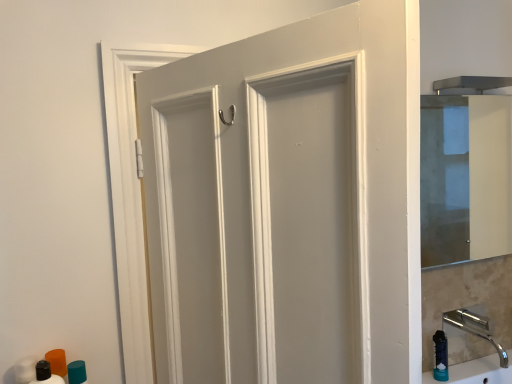
What do you see at coordinates (287, 203) in the screenshot? I see `matte white door at center` at bounding box center [287, 203].

What is the approximate height of matte white door at center?

It is 36.67 inches.

What do you see at coordinates (42, 367) in the screenshot?
I see `matte black bottle at lower left, marked as the second toiletry in a back-to-front arrangement` at bounding box center [42, 367].

Describe the element at coordinates (474, 328) in the screenshot. I see `polished chrome faucet at lower right` at that location.

Locate an element on the screen. Image resolution: width=512 pixels, height=384 pixels. transparent glass cabinet at right is located at coordinates click(x=465, y=178).

From the image's perspective, which is below, teal matte cylinder at lower left, the 1th toiletry viewed from the back, or matte white door at center?

From the image's view, teal matte cylinder at lower left, the 1th toiletry viewed from the back, is below.

Can you tell me how much teal matte cylinder at lower left, the 1th toiletry viewed from the back, and matte white door at center differ in facing direction?

They differ by 111 degrees in their facing directions.

Is teal matte cylinder at lower left, the 2th toiletry from the front, positioned far away from matte white door at center?

No.

Considering the relative sizes of teal matte cylinder at lower left, the 2th toiletry from the front, and matte white door at center in the image provided, is teal matte cylinder at lower left, the 2th toiletry from the front, wider than matte white door at center?

Incorrect, the width of teal matte cylinder at lower left, the 2th toiletry from the front, does not surpass that of matte white door at center.

Where is `mirror that appears above the matte white door at center (from a real-world perspective)`? mirror that appears above the matte white door at center (from a real-world perspective) is located at coordinates (465, 178).

Are transparent glass cabinet at right and matte white door at center located far from each other?

Yes, transparent glass cabinet at right and matte white door at center are located far from each other.

From the image's perspective, is transparent glass cabinet at right located beneath matte white door at center?

No.

Considering their positions, is transparent glass cabinet at right located in front of or behind matte white door at center?

In the image, transparent glass cabinet at right appears behind matte white door at center.

From the image's perspective, is blue rubber soap dispenser at lower right located above polished chrome faucet at lower right?

No.

Based on the photo, between blue rubber soap dispenser at lower right and polished chrome faucet at lower right, which one has more height?

blue rubber soap dispenser at lower right.

Is the position of blue rubber soap dispenser at lower right less distant than that of polished chrome faucet at lower right?

That is False.

Are blue rubber soap dispenser at lower right and polished chrome faucet at lower right far apart?

No.

Would you say blue rubber soap dispenser at lower right is part of polished chrome faucet at lower right's contents?

No, blue rubber soap dispenser at lower right is located outside of polished chrome faucet at lower right.

From a real-world perspective, is polished chrome faucet at lower right over blue rubber soap dispenser at lower right?

Yes, from a real-world perspective, polished chrome faucet at lower right is above blue rubber soap dispenser at lower right.

From the image's perspective, is polished chrome faucet at lower right above or below blue rubber soap dispenser at lower right?

Based on their image positions, polished chrome faucet at lower right is located above blue rubber soap dispenser at lower right.

Is matte white door at center completely or partially inside matte black bottle at lower left, the first toiletry when ordered from front to back?

No, matte white door at center is located outside of matte black bottle at lower left, the first toiletry when ordered from front to back.

Which is more to the right, matte black bottle at lower left, marked as the second toiletry in a back-to-front arrangement, or matte white door at center?

From the viewer's perspective, matte white door at center appears more on the right side.

From the image's perspective, would you say matte black bottle at lower left, the first toiletry when ordered from front to back, is shown under matte white door at center?

Correct, matte black bottle at lower left, the first toiletry when ordered from front to back, appears lower than matte white door at center in the image.

Looking at this image, which of these two, matte black bottle at lower left, marked as the second toiletry in a back-to-front arrangement, or matte white door at center, is bigger?

matte white door at center is bigger.

From the image's perspective, does matte black bottle at lower left, marked as the second toiletry in a back-to-front arrangement, appear lower than teal matte cylinder at lower left, the 1th toiletry viewed from the back?

No.

I want to click on toiletry on the left side of teal matte cylinder at lower left, the 2th toiletry from the front, so click(42, 367).

From a real-world perspective, is matte black bottle at lower left, the first toiletry when ordered from front to back, positioned over teal matte cylinder at lower left, the 1th toiletry viewed from the back, based on gravity?

Yes, from a real-world perspective, matte black bottle at lower left, the first toiletry when ordered from front to back, is over teal matte cylinder at lower left, the 1th toiletry viewed from the back

Is matte black bottle at lower left, marked as the second toiletry in a back-to-front arrangement, positioned beyond the bounds of blue rubber soap dispenser at lower right?

Yes, matte black bottle at lower left, marked as the second toiletry in a back-to-front arrangement, is not within blue rubber soap dispenser at lower right.

What's the angular difference between matte black bottle at lower left, marked as the second toiletry in a back-to-front arrangement, and blue rubber soap dispenser at lower right's facing directions?

There is a 1.87-degree angle between the facing directions of matte black bottle at lower left, marked as the second toiletry in a back-to-front arrangement, and blue rubber soap dispenser at lower right.

From a real-world perspective, who is located lower, matte black bottle at lower left, marked as the second toiletry in a back-to-front arrangement, or blue rubber soap dispenser at lower right?

blue rubber soap dispenser at lower right, from a real-world perspective.

Find the location of a particular element. door on the right of the teal matte cylinder at lower left, the 2th toiletry from the front is located at coordinates (287, 203).

Locate an element on the screen. mirror that appears above the matte white door at center (from the image's perspective) is located at coordinates (465, 178).

Considering their positions, is teal matte cylinder at lower left, the 2th toiletry from the front, positioned further to transparent glass cabinet at right than matte white door at center?

teal matte cylinder at lower left, the 2th toiletry from the front, is further to transparent glass cabinet at right.

When comparing their distances from transparent glass cabinet at right, does matte white door at center or polished chrome faucet at lower right seem further?

Among the two, matte white door at center is located further to transparent glass cabinet at right.

When comparing their distances from transparent glass cabinet at right, does matte black bottle at lower left, marked as the second toiletry in a back-to-front arrangement, or polished chrome faucet at lower right seem further?

Based on the image, matte black bottle at lower left, marked as the second toiletry in a back-to-front arrangement, appears to be further to transparent glass cabinet at right.

From the picture: Looking at the image, which one is located further to blue rubber soap dispenser at lower right, matte black bottle at lower left, the first toiletry when ordered from front to back, or matte white door at center?

matte black bottle at lower left, the first toiletry when ordered from front to back, is further to blue rubber soap dispenser at lower right.

Looking at this image, which object lies further to the anchor point polished chrome faucet at lower right, matte black bottle at lower left, the first toiletry when ordered from front to back, or matte white door at center?

matte black bottle at lower left, the first toiletry when ordered from front to back.

Looking at the image, which one is located further to matte white door at center, matte black bottle at lower left, marked as the second toiletry in a back-to-front arrangement, or teal matte cylinder at lower left, the 1th toiletry viewed from the back?

Based on the image, teal matte cylinder at lower left, the 1th toiletry viewed from the back, appears to be further to matte white door at center.

Estimate the real-world distances between objects in this image. Which object is further from polished chrome faucet at lower right, blue rubber soap dispenser at lower right or matte black bottle at lower left, marked as the second toiletry in a back-to-front arrangement?

matte black bottle at lower left, marked as the second toiletry in a back-to-front arrangement.

Looking at the image, which one is located closer to teal matte cylinder at lower left, the 2th toiletry from the front, matte black bottle at lower left, the first toiletry when ordered from front to back, or matte white door at center?

matte black bottle at lower left, the first toiletry when ordered from front to back, lies closer to teal matte cylinder at lower left, the 2th toiletry from the front, than the other object.

The height and width of the screenshot is (384, 512). Find the location of `soap dispenser between matte white door at center and transparent glass cabinet at right along the z-axis`. soap dispenser between matte white door at center and transparent glass cabinet at right along the z-axis is located at coordinates (440, 356).

Where is `toiletry between matte black bottle at lower left, the first toiletry when ordered from front to back, and transparent glass cabinet at right from left to right`? This screenshot has width=512, height=384. toiletry between matte black bottle at lower left, the first toiletry when ordered from front to back, and transparent glass cabinet at right from left to right is located at coordinates (x=77, y=372).

This screenshot has height=384, width=512. I want to click on soap dispenser located between teal matte cylinder at lower left, the 2th toiletry from the front, and transparent glass cabinet at right in the left-right direction, so click(440, 356).

In order to click on door situated between teal matte cylinder at lower left, the 1th toiletry viewed from the back, and blue rubber soap dispenser at lower right from left to right in this screenshot , I will do `click(287, 203)`.